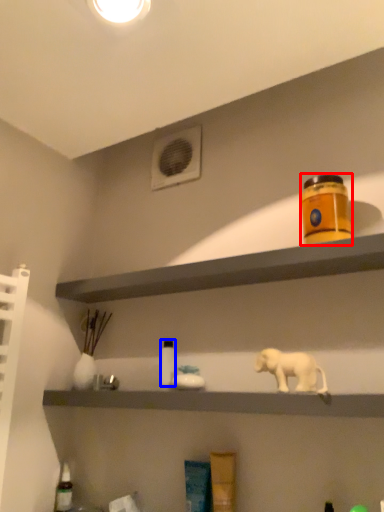
Question: Among these objects, which one is farthest to the camera, product (highlighted by a red box) or bottle (highlighted by a blue box)?

Choices:
 (A) product
 (B) bottle

Answer: (B)